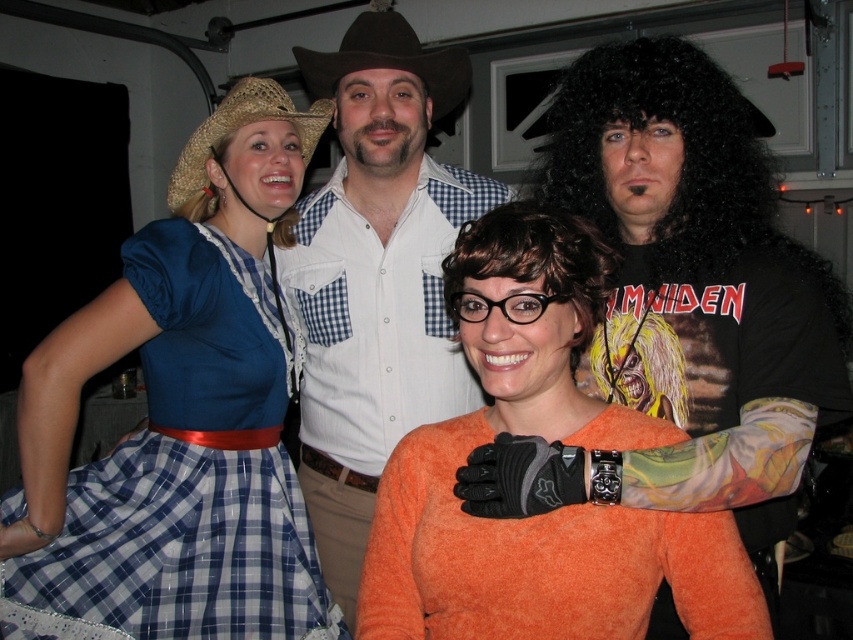
You are standing in the garage and want to reach both points, point (x=778, y=476) and point (x=202, y=120). Which point should you approach first to reach the closer one?

Point (x=778, y=476) is closer to the viewer than point (x=202, y=120), so you should approach point (x=778, y=476) first.

You are organizing a costume party and need to ensure all props and outfits fit through a narrow doorway. The blue plaid dress at left and the brown felt cowboy hat at upper center are part of the costumes. Which item requires more space due to its size?

The blue plaid dress at left is bigger than the brown felt cowboy hat at upper center, so it requires more space to fit through the doorway.